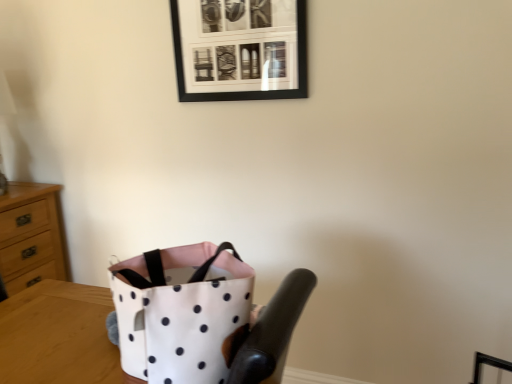
Question: From a real-world perspective, is black matte picture frame at upper center located beneath white fabric bag at center?

Choices:
 (A) no
 (B) yes

Answer: (A)

Question: Can you confirm if black matte picture frame at upper center is smaller than white fabric bag at center?

Choices:
 (A) yes
 (B) no

Answer: (A)

Question: Is black matte picture frame at upper center shorter than white fabric bag at center?

Choices:
 (A) no
 (B) yes

Answer: (B)

Question: Considering the relative sizes of black matte picture frame at upper center and white fabric bag at center in the image provided, is black matte picture frame at upper center bigger than white fabric bag at center?

Choices:
 (A) yes
 (B) no

Answer: (B)

Question: Would you say black matte picture frame at upper center is outside white fabric bag at center?

Choices:
 (A) no
 (B) yes

Answer: (B)

Question: From a real-world perspective, is white fabric bag at center physically located above or below white polka dot fabric bag at lower center?

Choices:
 (A) below
 (B) above

Answer: (A)

Question: Does point (102, 309) appear closer or farther from the camera than point (181, 251)?

Choices:
 (A) farther
 (B) closer

Answer: (A)

Question: From their relative heights in the image, would you say white fabric bag at center is taller or shorter than white polka dot fabric bag at lower center?

Choices:
 (A) short
 (B) tall

Answer: (B)

Question: Is white fabric bag at center situated inside white polka dot fabric bag at lower center or outside?

Choices:
 (A) inside
 (B) outside

Answer: (B)

Question: From a real-world perspective, is white fabric bag at center above or below wooden chest of drawers at left?

Choices:
 (A) above
 (B) below

Answer: (A)

Question: Considering their positions, is white fabric bag at center located in front of or behind wooden chest of drawers at left?

Choices:
 (A) front
 (B) behind

Answer: (A)

Question: Is white fabric bag at center to the left or to the right of wooden chest of drawers at left in the image?

Choices:
 (A) right
 (B) left

Answer: (A)

Question: Does point (22, 345) appear closer or farther from the camera than point (29, 263)?

Choices:
 (A) farther
 (B) closer

Answer: (B)

Question: Looking at their shapes, would you say white fabric bag at center is wider or thinner than black matte picture frame at upper center?

Choices:
 (A) thin
 (B) wide

Answer: (B)

Question: Based on their positions, is white fabric bag at center located to the left or right of black matte picture frame at upper center?

Choices:
 (A) left
 (B) right

Answer: (A)